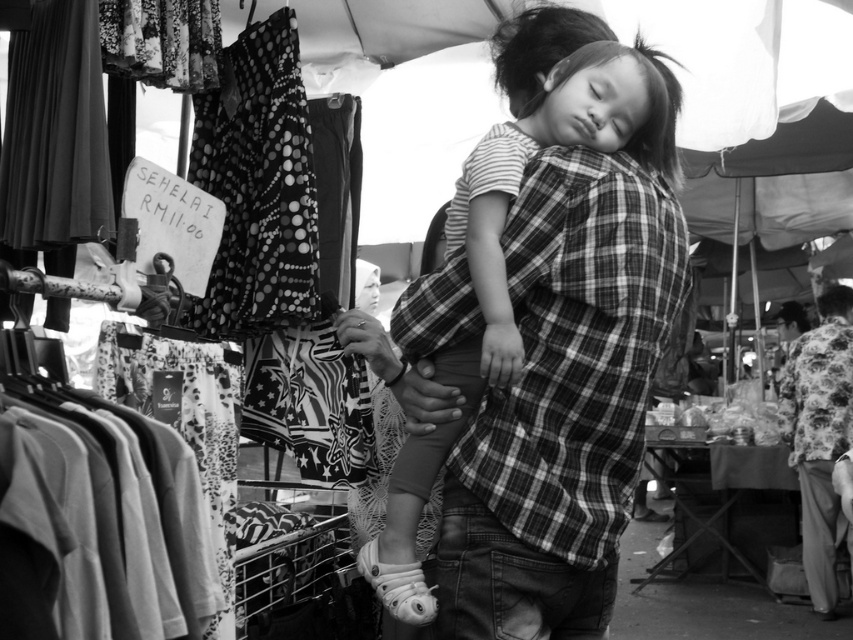
Question: Which of the following is the farthest from the observer?

Choices:
 (A) soft cotton shirt at center
 (B) floral-patterned shirt at right

Answer: (B)

Question: Can you confirm if soft cotton shirt at center is thinner than floral-patterned shirt at right?

Choices:
 (A) yes
 (B) no

Answer: (B)

Question: Where is soft cotton shirt at center located in relation to floral-patterned shirt at right in the image?

Choices:
 (A) below
 (B) above

Answer: (B)

Question: Does soft cotton shirt at center have a lesser width compared to floral-patterned shirt at right?

Choices:
 (A) no
 (B) yes

Answer: (A)